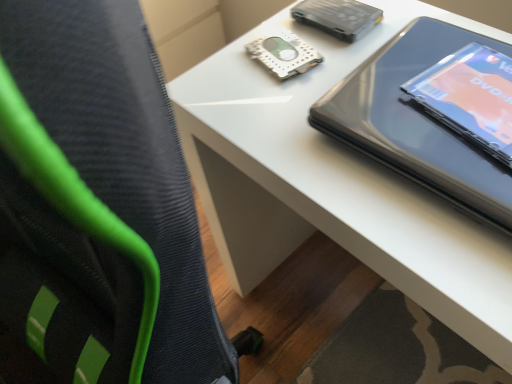
Question: From a real-world perspective, is matte black tablet at upper right physically located above or below white glossy table at upper right?

Choices:
 (A) above
 (B) below

Answer: (A)

Question: Does point 391,89 appear closer or farther from the camera than point 397,215?

Choices:
 (A) farther
 (B) closer

Answer: (A)

Question: Which is correct: matte black tablet at upper right is inside white glossy table at upper right, or outside of it?

Choices:
 (A) inside
 (B) outside

Answer: (A)

Question: In the image, is white glossy table at upper right on the left side or the right side of matte black tablet at upper right?

Choices:
 (A) left
 (B) right

Answer: (A)

Question: Is point (269, 269) closer or farther from the camera than point (387, 160)?

Choices:
 (A) farther
 (B) closer

Answer: (A)

Question: From the image's perspective, is white glossy table at upper right located above or below matte black tablet at upper right?

Choices:
 (A) above
 (B) below

Answer: (B)

Question: In the image, is white glossy table at upper right positioned in front of or behind matte black tablet at upper right?

Choices:
 (A) front
 (B) behind

Answer: (A)